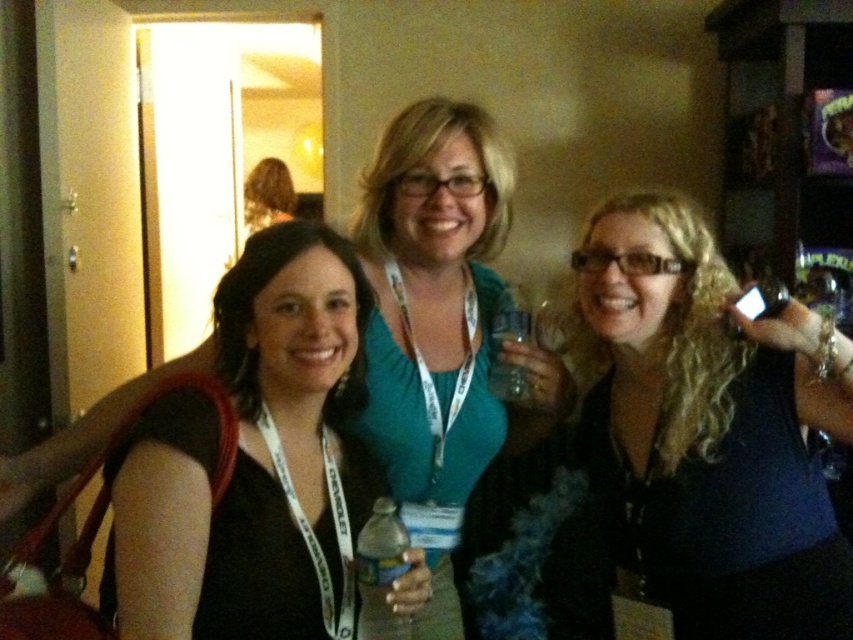
Can you confirm if black fabric shirt at right is wider than translucent plastic water bottle at center?

Yes.

Does point (827, 548) come closer to viewer compared to point (399, 554)?

No.

At what (x,y) coordinates should I click in order to perform the action: click on black fabric shirt at right. Please return your answer as a coordinate pair (x, y). Looking at the image, I should click on (714, 426).

Image resolution: width=853 pixels, height=640 pixels. What do you see at coordinates (714, 426) in the screenshot? I see `black fabric shirt at right` at bounding box center [714, 426].

Looking at this image, can you confirm if black fabric shirt at right is positioned to the left of black fabric at center?

Incorrect, black fabric shirt at right is not on the left side of black fabric at center.

The width and height of the screenshot is (853, 640). I want to click on black fabric shirt at right, so click(714, 426).

Is black fabric at center further to the viewer compared to translucent plastic water bottle at center?

That is False.

Is black fabric at center smaller than translucent plastic water bottle at center?

Incorrect, black fabric at center is not smaller in size than translucent plastic water bottle at center.

Between point (224, 513) and point (369, 611), which one is positioned in front?

Positioned in front is point (224, 513).

Image resolution: width=853 pixels, height=640 pixels. I want to click on black fabric at center, so click(x=258, y=452).